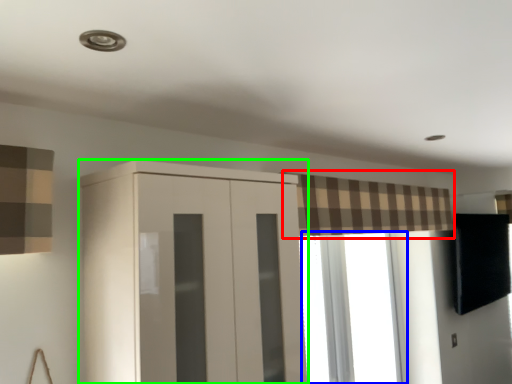
Question: Estimate the real-world distances between objects in this image. Which object is farther from curtain (highlighted by a red box), window (highlighted by a blue box) or cupboard (highlighted by a green box)?

Choices:
 (A) window
 (B) cupboard

Answer: (B)